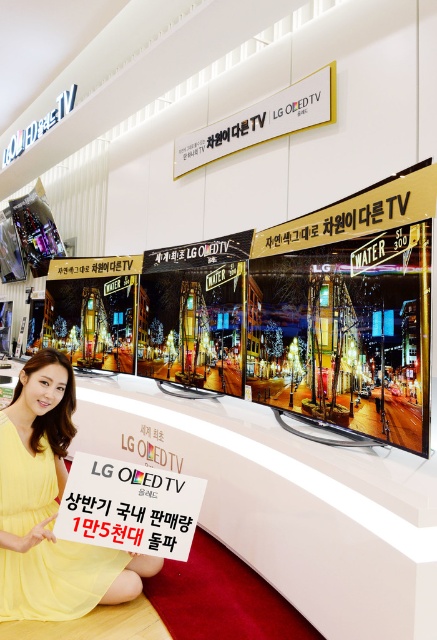
You are a customer at the LG OLED TV display and see the white paper sign at center and the white metallic sign at upper center. Which sign is more to the left?

The white paper sign at center is more to the left side of the white metallic sign at upper center.

You are standing in front of the LG OLED TV display. There is a woman in a bright yellow dress at center. Where is the yellow fabric dress located relative to the point marked at coordinates (x=55, y=579)?

The point at coordinates (x=55, y=579) indicates the location of the yellow fabric dress at center, so the yellow fabric dress is exactly at that point.

You are a photographer at the LG OLED TV promotional display. You need to capture a photo where both the yellow fabric dress at center and the white paper sign at center are visible. Based on their sizes, which object will appear smaller in the photo?

The yellow fabric dress at center will appear smaller in the photo because its width is less than the white paper sign at center.